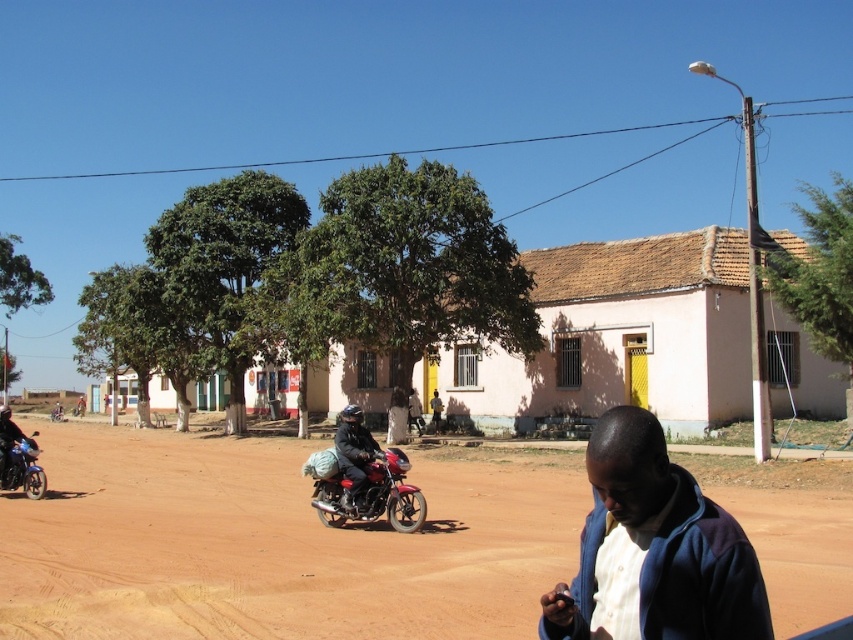
Is the position of brown dirt field at center less distant than that of shiny red motorcycle at center?

That is True.

Does brown dirt field at center appear over shiny red motorcycle at center?

No, brown dirt field at center is not above shiny red motorcycle at center.

Is point (819, 609) farther from viewer compared to point (386, 476)?

No, (819, 609) is closer to viewer.

I want to click on brown dirt field at center, so (271, 545).

Does pink stucco building at center have a greater width compared to metallic blue motorbike at left?

Yes.

Which of these two, pink stucco building at center or metallic blue motorbike at left, stands taller?

pink stucco building at center

At what (x,y) coordinates should I click in order to perform the action: click on pink stucco building at center. Please return your answer as a coordinate pair (x, y). The height and width of the screenshot is (640, 853). Looking at the image, I should click on (618, 339).

This screenshot has height=640, width=853. In order to click on pink stucco building at center in this screenshot , I will do `click(618, 339)`.

Is point (339, 504) farther from viewer compared to point (25, 467)?

That is False.

Does shiny red motorcycle at center have a smaller size compared to metallic blue motorbike at left?

Indeed, shiny red motorcycle at center has a smaller size compared to metallic blue motorbike at left.

Is point (375, 477) behind point (25, 486)?

No, (375, 477) is in front of (25, 486).

Find the location of `shiny red motorcycle at center`. shiny red motorcycle at center is located at coordinates (372, 493).